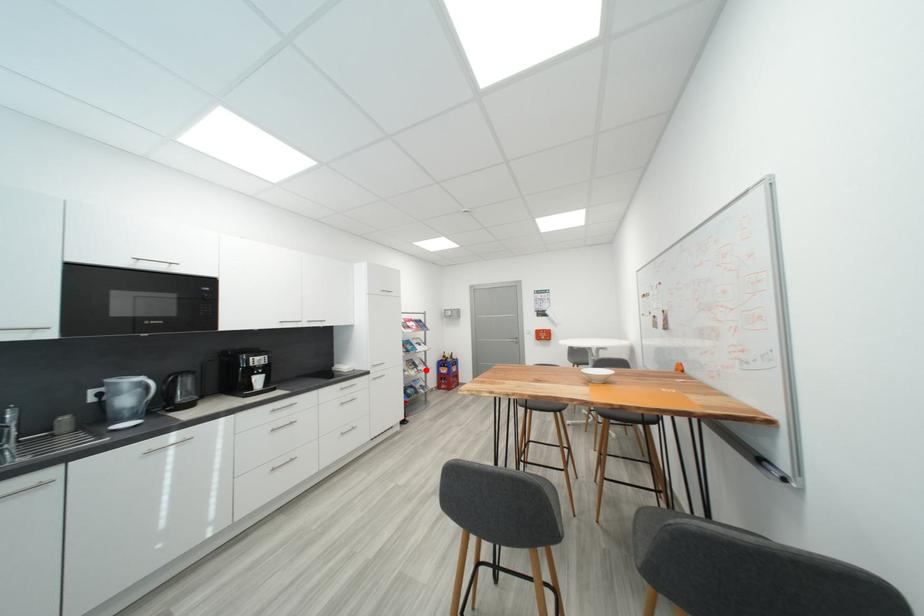
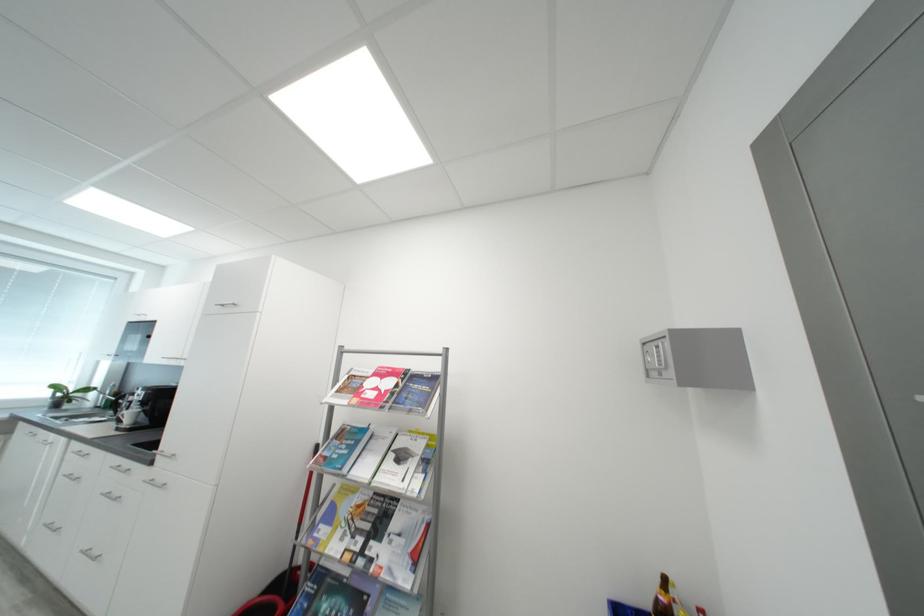
Locate, in the second image, the point that corresponds to the highlighted location in the first image.

(380, 549)